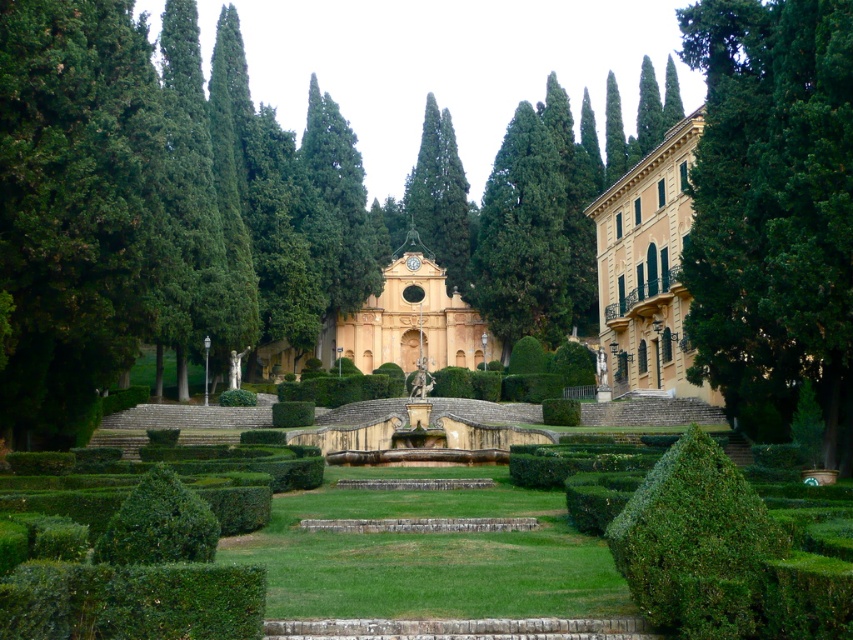
Is green leafy tree at right closer to the viewer compared to matte yellow palace at center?

That is True.

Between point (775, 80) and point (373, 310), which one is positioned in front?

Positioned in front is point (775, 80).

Locate an element on the screen. green leafy tree at right is located at coordinates (773, 211).

Is point (849, 262) positioned after point (625, 525)?

Yes, it is.

Is green leafy tree at right to the left of green leafy bush at center from the viewer's perspective?

In fact, green leafy tree at right is to the right of green leafy bush at center.

Does point (825, 240) come farther from viewer compared to point (669, 541)?

Yes.

At what (x,y) coordinates should I click in order to perform the action: click on green leafy tree at right. Please return your answer as a coordinate pair (x, y). Image resolution: width=853 pixels, height=640 pixels. Looking at the image, I should click on 773,211.

Can you confirm if green leafy tree at right is positioned to the left of green leafy bush at lower left?

Incorrect, green leafy tree at right is not on the left side of green leafy bush at lower left.

Is green leafy tree at right closer to the viewer compared to green leafy bush at lower left?

That is False.

In order to click on green leafy tree at right in this screenshot , I will do `click(773, 211)`.

The width and height of the screenshot is (853, 640). In order to click on green leafy tree at right in this screenshot , I will do `click(773, 211)`.